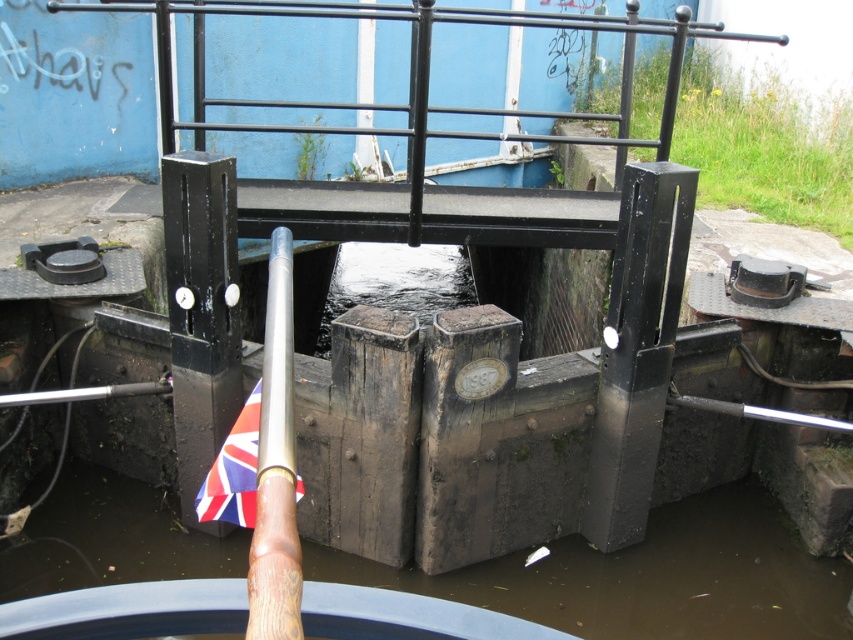
Question: Can you confirm if brown wooden paddle at lower center is bigger than silver polished wood pole at center?

Choices:
 (A) no
 (B) yes

Answer: (B)

Question: Which point is closer to the camera?

Choices:
 (A) union jack fabric at center
 (B) silver polished wood pole at center

Answer: (B)

Question: Which point is farther to the camera?

Choices:
 (A) brown wooden paddle at lower center
 (B) union jack fabric at center

Answer: (A)

Question: Which object is positioned farthest from the brown wooden paddle at lower center?

Choices:
 (A) union jack fabric at center
 (B) silver polished wood pole at center

Answer: (B)

Question: Is brown wooden paddle at lower center behind union jack fabric at center?

Choices:
 (A) no
 (B) yes

Answer: (B)

Question: Is brown wooden paddle at lower center smaller than union jack fabric at center?

Choices:
 (A) yes
 (B) no

Answer: (B)